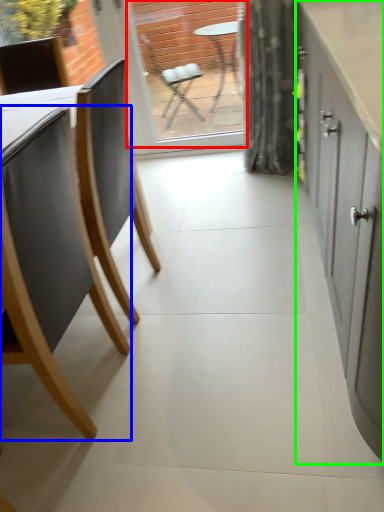
Question: Which is farther away from window screen (highlighted by a red box)? chair (highlighted by a blue box) or cabinetry (highlighted by a green box)?

Choices:
 (A) chair
 (B) cabinetry

Answer: (A)